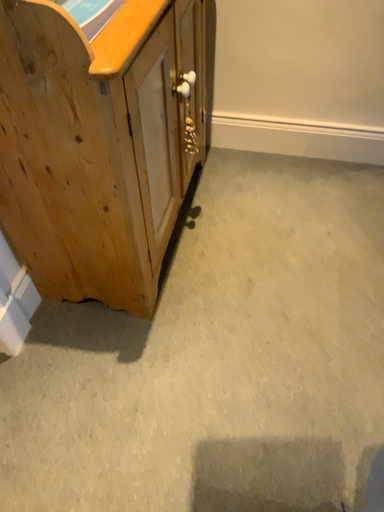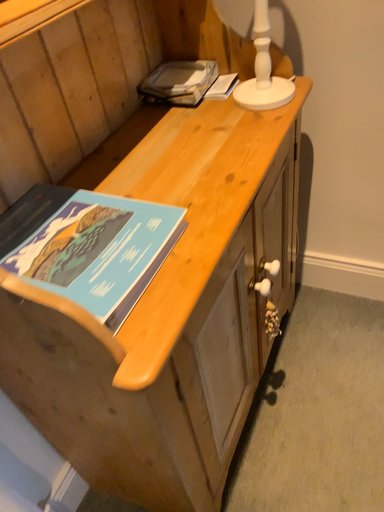
Question: Which way did the camera rotate in the video?

Choices:
 (A) rotated upward
 (B) rotated downward

Answer: (A)